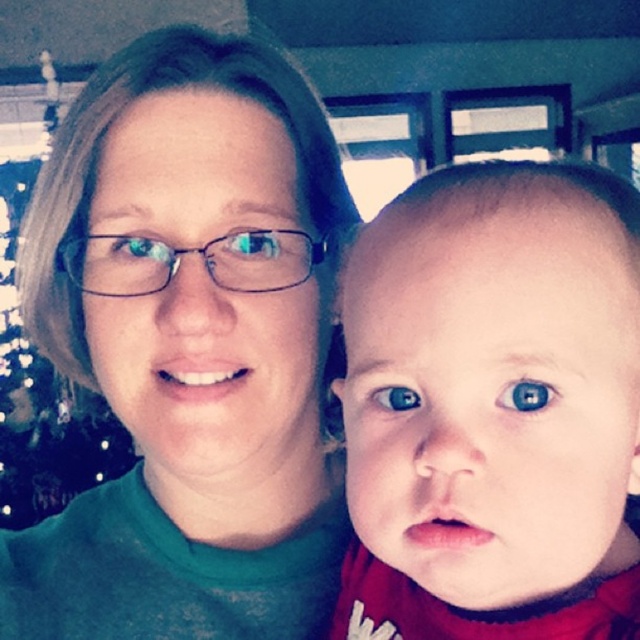
Question: Can you confirm if green matte shirt at center is bigger than smooth skin baby at center?

Choices:
 (A) no
 (B) yes

Answer: (B)

Question: Considering the relative positions of green matte shirt at center and smooth skin baby at center in the image provided, where is green matte shirt at center located with respect to smooth skin baby at center?

Choices:
 (A) above
 (B) below

Answer: (A)

Question: Which of the following is the farthest from the observer?

Choices:
 (A) (234, 257)
 (B) (516, 611)

Answer: (A)

Question: Does green matte shirt at center appear on the left side of smooth skin baby at center?

Choices:
 (A) yes
 (B) no

Answer: (A)